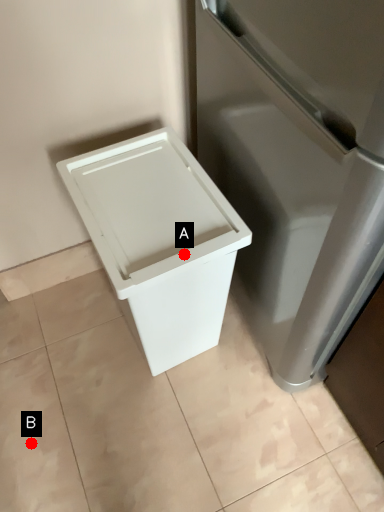
Question: Two points are circled on the image, labeled by A and B beside each circle. Which of the following is the farthest from the observer?

Choices:
 (A) A is further
 (B) B is further

Answer: (B)